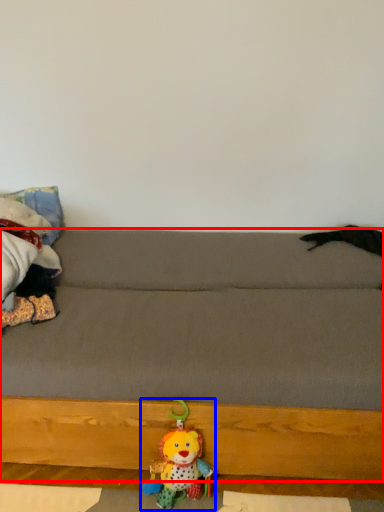
Question: Among these objects, which one is farthest to the camera, studio couch (highlighted by a red box) or toy (highlighted by a blue box)?

Choices:
 (A) studio couch
 (B) toy

Answer: (B)